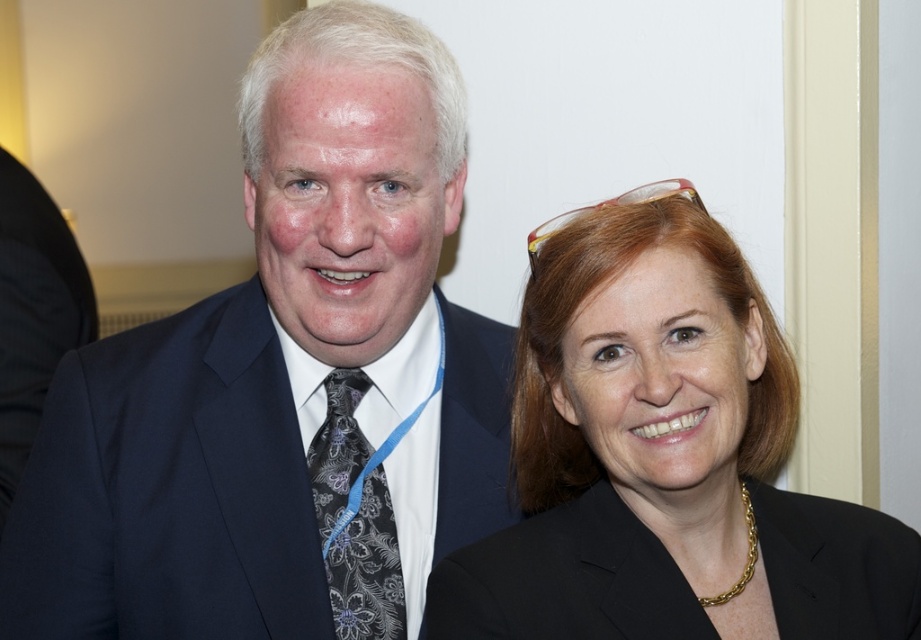
Question: Which point is farther to the camera?

Choices:
 (A) black floral-patterned tie at left
 (B) matte black blazer at center
 (C) dark blue suit at center
 (D) black matte blazer at lower right

Answer: (A)

Question: Does dark blue suit at center appear on the right side of black matte blazer at lower right?

Choices:
 (A) yes
 (B) no

Answer: (B)

Question: Which point appears closest to the camera in this image?

Choices:
 (A) 341,417
 (B) 622,208

Answer: (B)

Question: Which object appears closest to the camera in this image?

Choices:
 (A) matte black blazer at center
 (B) dark blue suit at center

Answer: (A)

Question: Does matte black blazer at center have a larger size compared to black floral-patterned tie at left?

Choices:
 (A) no
 (B) yes

Answer: (B)

Question: Can you confirm if dark blue suit at center is wider than black floral-patterned tie at left?

Choices:
 (A) yes
 (B) no

Answer: (A)